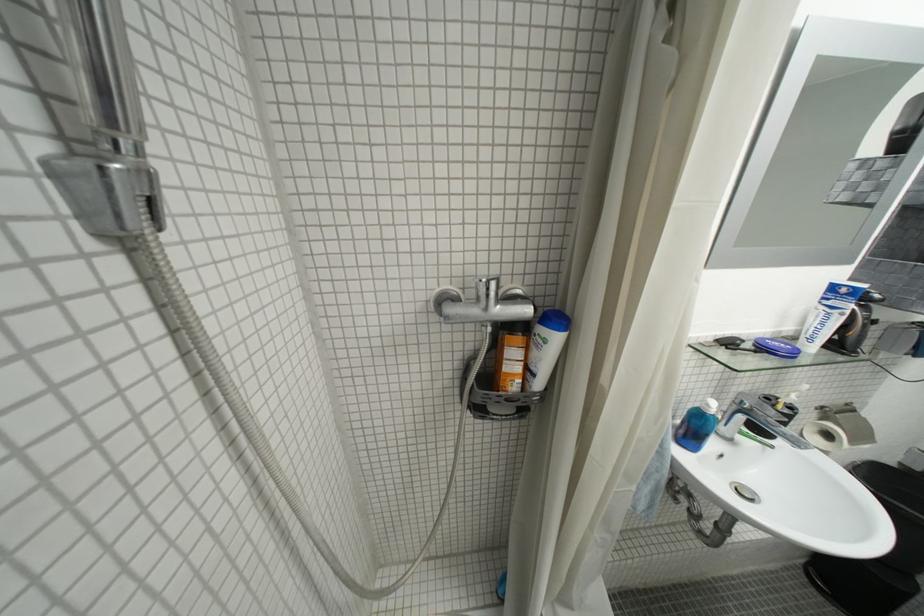
Image resolution: width=924 pixels, height=616 pixels. I want to click on chrome sink faucet handle, so click(772, 414).